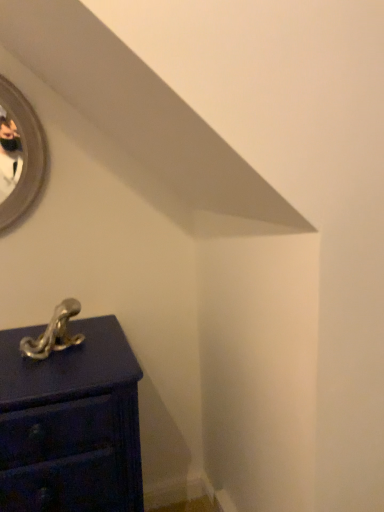
You are a GUI agent. You are given a task and a screenshot of the screen. Output one action in this format:
    pyautogui.click(x=<x>, y=<y>)
    Task: Click on the vacant space behind polished silver hook at lower left
    The height and width of the screenshot is (512, 384).
    Given the screenshot: What is the action you would take?
    pyautogui.click(x=73, y=330)